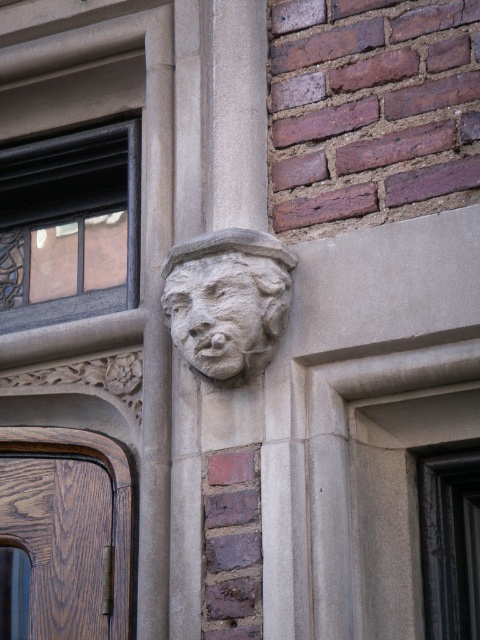
You are an architect examining the building exterior. You notice a specific point marked at coordinates (228, 301). Based on the scene, where is this point located?

The point at (228, 301) is on the gray stone face at center.

You are standing in front of a building and need to enter through the brown wood door at lower left. There is a stone carved face at upper center above the door. How does the distance of the door compare to the stone carved face in terms of proximity to you?

The brown wood door at lower left is closer to you than the stone carved face at upper center, so you can reach the door first before the face.